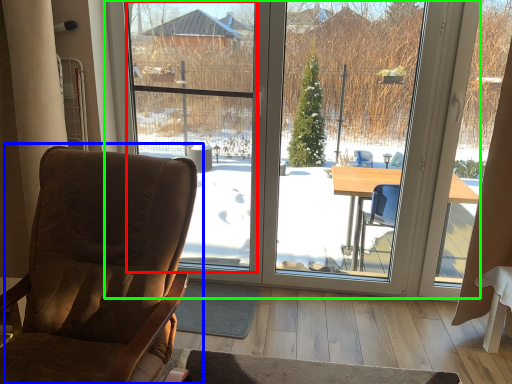
Question: Considering the real-world distances, which object is farthest from window screen (highlighted by a red box)? chair (highlighted by a blue box) or window (highlighted by a green box)?

Choices:
 (A) chair
 (B) window

Answer: (A)